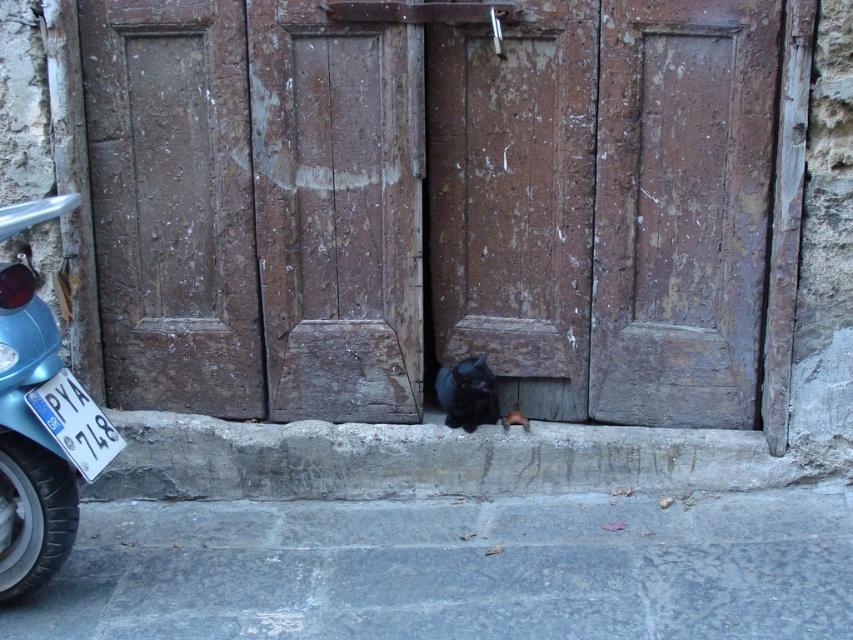
You are a delivery person trying to reach the apartment above the rusty wood door at center. You see the black fur cat at center blocking the entrance. Can you step around the cat to access the door?

The rusty wood door at center is positioned on the left side of the black fur cat at center, so you can step around the cat to the right side to access the door.

You are a delivery person trying to enter the building through the rusty wood door at center. The blue glossy motorcycle at left is blocking the entrance. Can you open the door without moving the motorcycle?

The rusty wood door at center is taller than the blue glossy motorcycle at left, so you can open the door without moving the motorcycle as there is enough vertical clearance.

You are a delivery person with a box that is 60 centimeters long. You need to place the box on the ledge in front of the rusty wood door at center. The black fur cat at center is sitting on the ledge. Can the box fit on the ledge without overlapping the cat?

The distance between the rusty wood door at center and the black fur cat at center is 56.09 centimeters. Since the box is 60 centimeters long, it would extend beyond the available space between the door and the cat, causing overlap. Therefore, the box cannot fit without overlapping the cat.